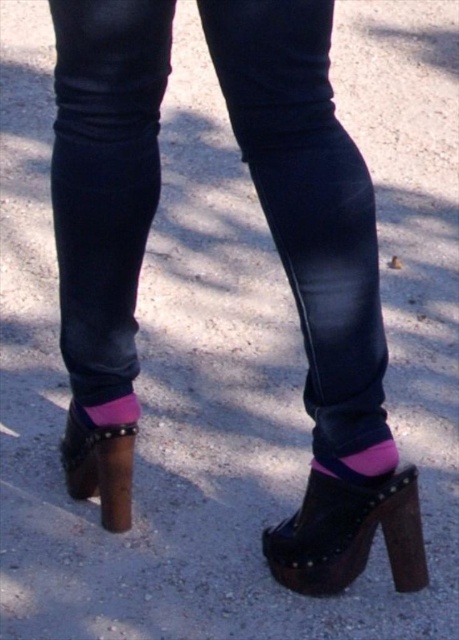
You are trying to decide between the two shoes in the image. The black leather platform shoe at lower center and the leather platform sandal at lower left. Which one do you think is wider?

The black leather platform shoe at lower center is wider than the leather platform sandal at lower left according to the description.

You are a photographer adjusting your camera to focus on the dark blue denim jeans at center and the leather platform sandal at lower left. Which object should you focus on first if you want to capture both in sharp detail?

You should focus on the dark blue denim jeans at center first because it is closer to the viewer than the leather platform sandal at lower left, ensuring both are in focus when using depth of field properly.